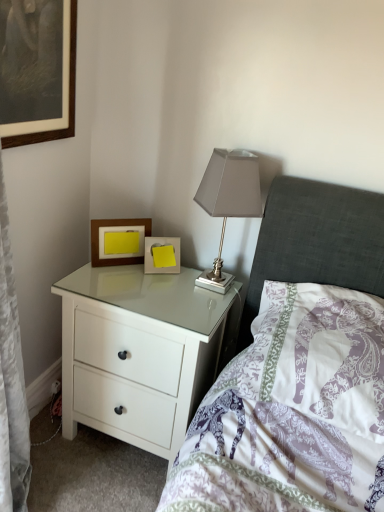
The width and height of the screenshot is (384, 512). What are the coordinates of `free location to the right of yellow paper at center, which is the third picture frame from left to right` in the screenshot? It's located at (189, 276).